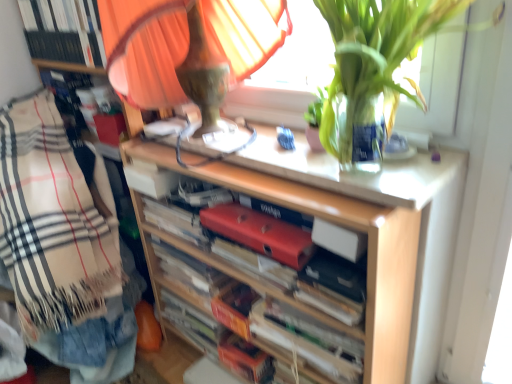
Question: In the image, is beige plaid blanket at left positioned in front of or behind hardcover book at center, which is counted as the 3th paperback book, starting from the top?

Choices:
 (A) behind
 (B) front

Answer: (A)

Question: Is point (23, 246) closer or farther from the camera than point (320, 256)?

Choices:
 (A) farther
 (B) closer

Answer: (A)

Question: Considering the real-world distances, which object is closest to the red matte folder at center, arranged as the 3th book when viewed from the top?

Choices:
 (A) wooden shelf at center
 (B) hardcover book at upper left, which is the 1th book from top to bottom
 (C) hardcover book at upper left, placed as the 4th book when sorted from bottom to top
 (D) matte red folder at center, arranged as the 2th paperback book when ordered from the bottom
 (E) red matte book at center, the third paperback book when ordered from bottom to top

Answer: (D)

Question: Based on their relative distances, which object is nearer to the hardcover book at upper left, which is the 1th book from top to bottom?

Choices:
 (A) red matte folder at center, arranged as the 3th book when viewed from the top
 (B) orange cardboard book at center, which appears as the 5th book when viewed from the top
 (C) hardcover book at center, which is the first paperback book in bottom-to-top order
 (D) red matte book at center, the third paperback book when ordered from bottom to top
 (E) matte red folder at center, arranged as the 2th paperback book when ordered from the bottom

Answer: (A)